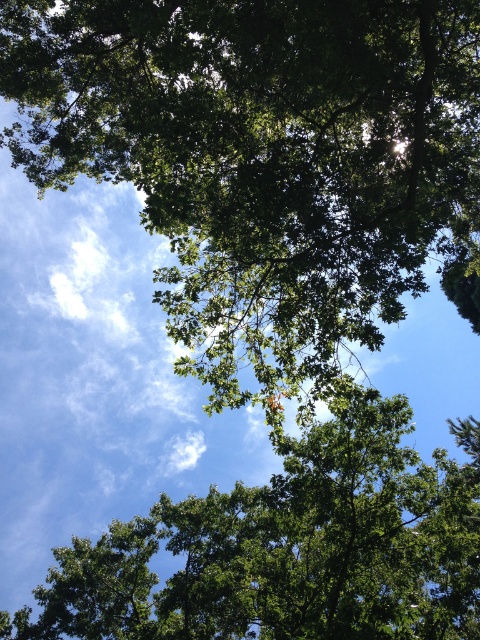
Question: Which point is closer to the camera?

Choices:
 (A) (305, 461)
 (B) (219, 212)

Answer: (B)

Question: Is green leafy tree at upper center thinner than green leafy tree at center?

Choices:
 (A) no
 (B) yes

Answer: (B)

Question: Can you confirm if green leafy tree at upper center is thinner than green leafy tree at center?

Choices:
 (A) yes
 (B) no

Answer: (A)

Question: Can you confirm if green leafy tree at upper center is positioned above green leafy tree at center?

Choices:
 (A) yes
 (B) no

Answer: (A)

Question: Among these points, which one is nearest to the camera?

Choices:
 (A) (20, 26)
 (B) (349, 413)

Answer: (B)